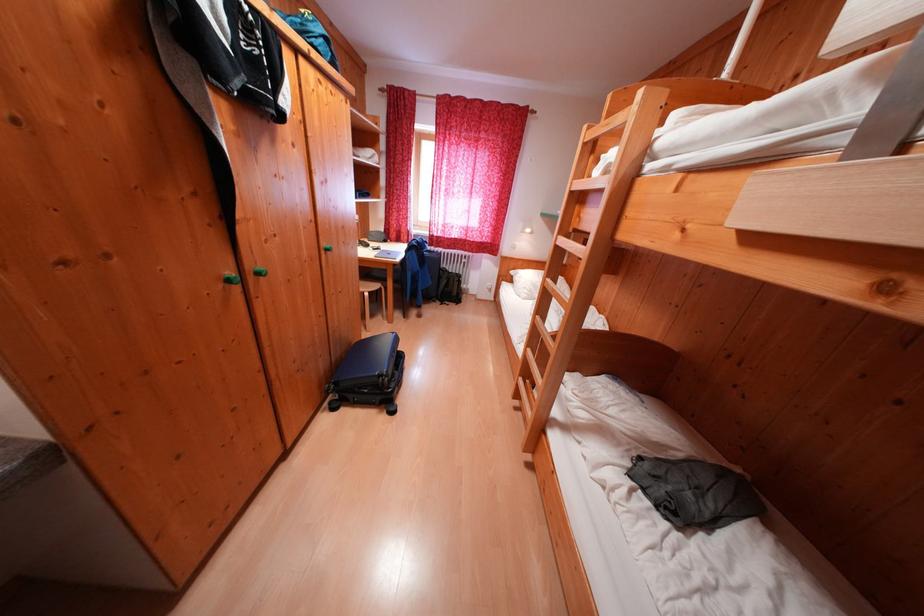
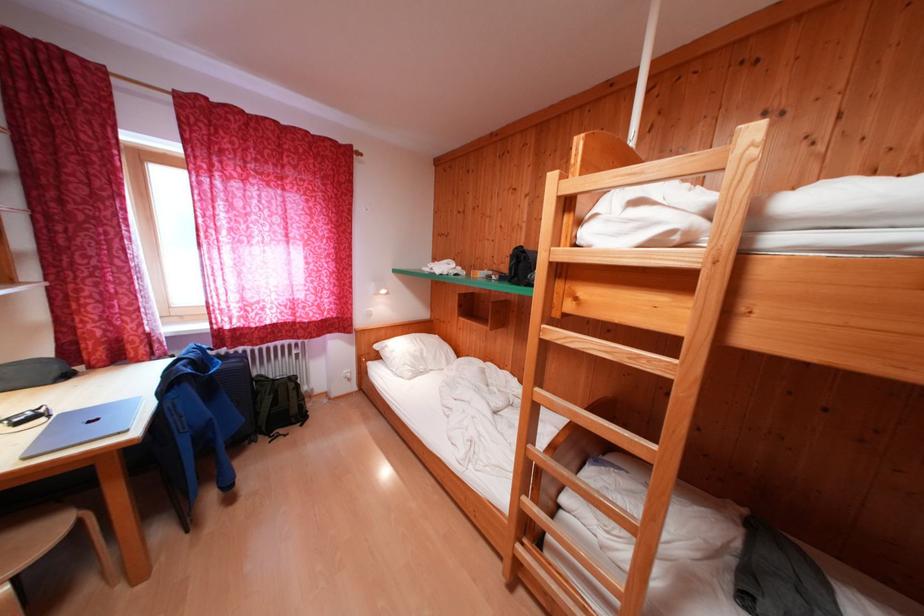
Question: The first image is from the beginning of the video and the second image is from the end. How did the camera likely rotate when shooting the video?

Choices:
 (A) Left
 (B) Right
 (C) Up
 (D) Down

Answer: (B)